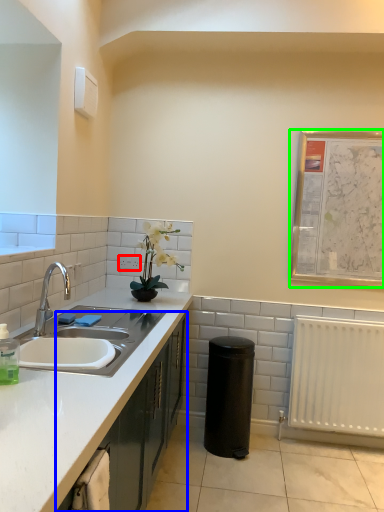
Question: Which object is positioned farthest from electric outlet (highlighted by a red box)? Select from cabinetry (highlighted by a blue box) and bulletin board (highlighted by a green box).

Choices:
 (A) cabinetry
 (B) bulletin board

Answer: (B)